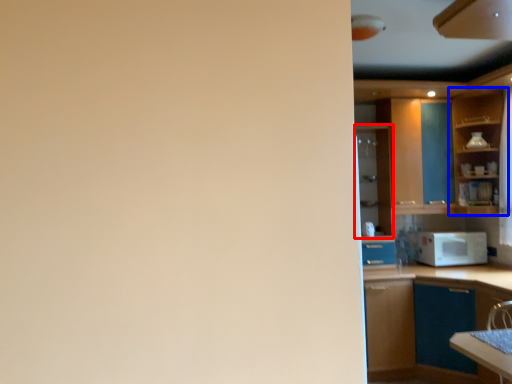
Question: Among these objects, which one is farthest to the camera, cabinetry (highlighted by a red box) or cabinetry (highlighted by a blue box)?

Choices:
 (A) cabinetry
 (B) cabinetry

Answer: (A)